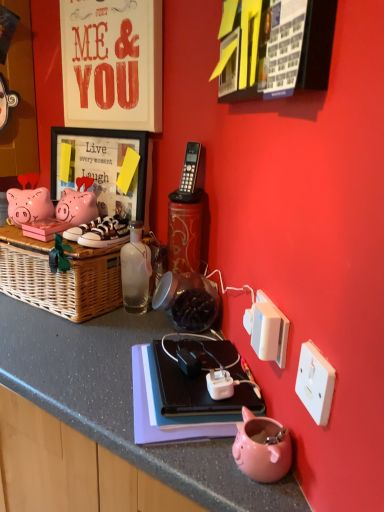
I want to click on vacant region to the left of white plastic power outlet at lower right, which is counted as the 2th power outlet, starting from the front, so click(x=176, y=387).